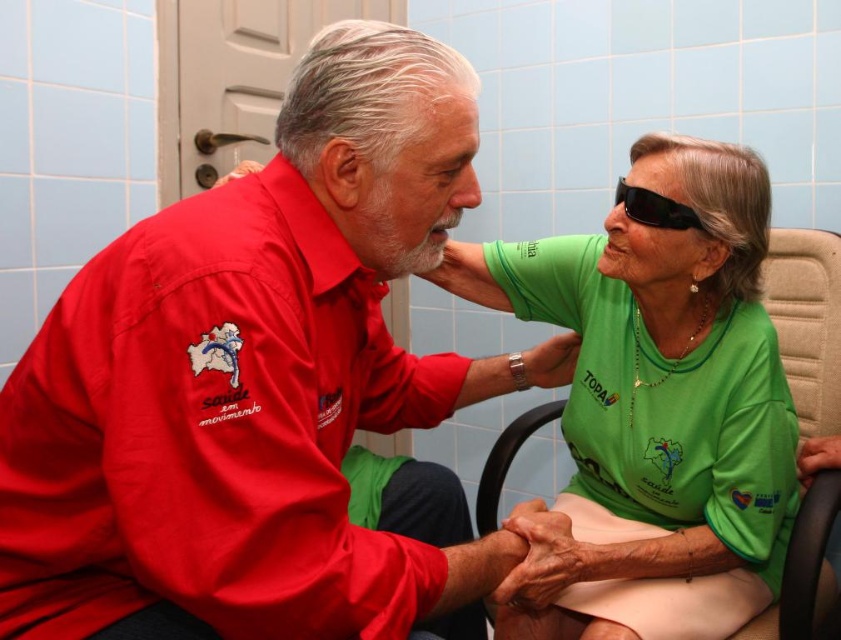
You are standing in a bathroom with light blue tiles and a white door. You see two points marked on the floor at coordinates point (220, 616) and point (463, 285). If you want to walk from the door to the first point, which direction should you go relative to the second point?

Point (220, 616) is in front of point (463, 285), so you should walk towards the direction of the first point which is ahead of the second point.